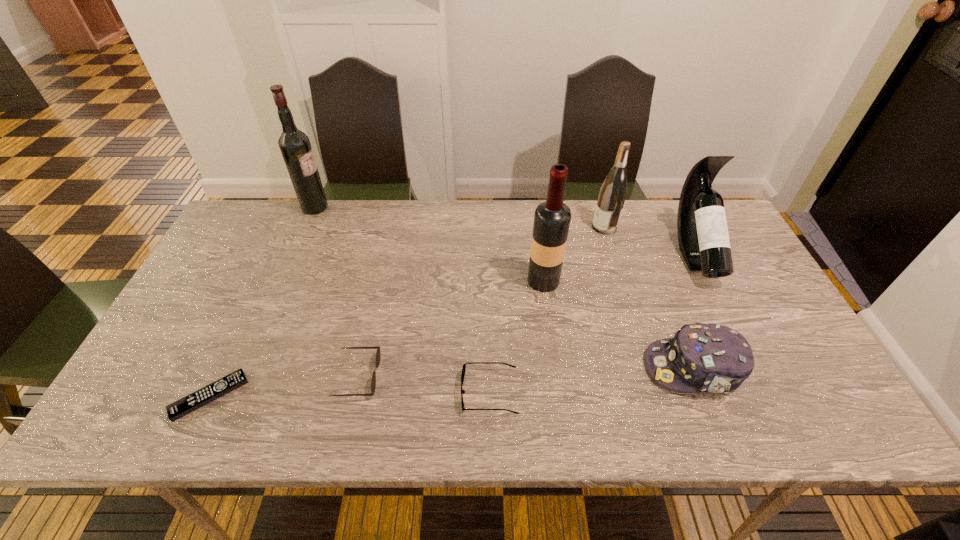
Identify the location of the closest wine bottle to the fifth tallest object. click(x=703, y=237).

I want to click on free location that satisfies the following two spatial constraints: 1. on the back side of the fourth object from right to left; 2. on the front and back of the farthest object, so click(x=534, y=207).

Locate an element on the screen. The image size is (960, 540). free spot that satisfies the following two spatial constraints: 1. on the back side of the third wine bottle from left to right; 2. on the left side of the fifth object from left to right is located at coordinates (536, 227).

This screenshot has height=540, width=960. Identify the location of vacant position in the image that satisfies the following two spatial constraints: 1. on the back side of the third wine bottle from left to right; 2. on the front and back of the farthest wine bottle. (598, 207).